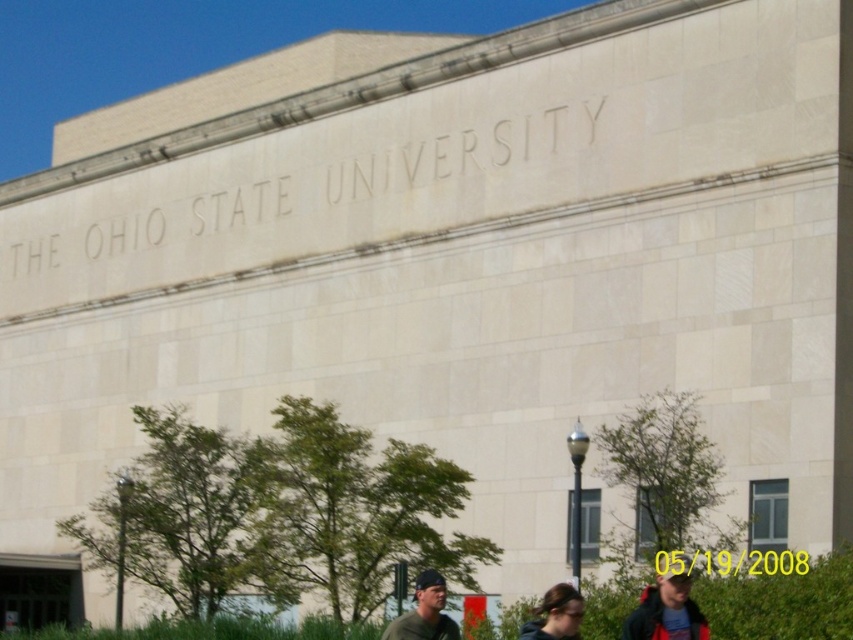
You are a photographer standing in front of the Ohio State University building. You notice a green leafy hedge at lower center and a dark brown hair at lower center. Which object is closer to the camera?

The green leafy hedge at lower center is positioned over the dark brown hair at lower center, meaning it is closer to the camera.

You are a photographer standing in front of the Ohio State University building. You notice a person wearing a matte green shirt at lower center and another with dark brown hair at lower center. From your perspective, which object is positioned higher?

The matte green shirt at lower center is positioned higher than the dark brown hair at lower center because it is described as being above it.